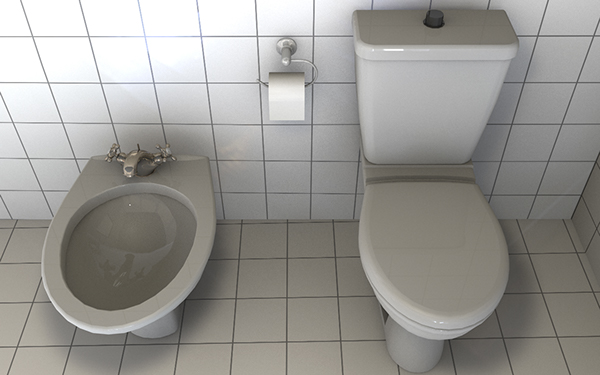
Find the location of a particular element. The width and height of the screenshot is (600, 375). faucet is located at coordinates (129, 167).